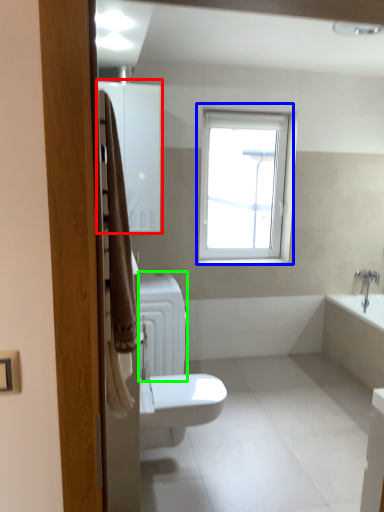
Question: Based on their relative distances, which object is nearer to medicine cabinet (highlighted by a red box)? Choose from window (highlighted by a blue box) and radiator (highlighted by a green box).

Choices:
 (A) window
 (B) radiator

Answer: (B)